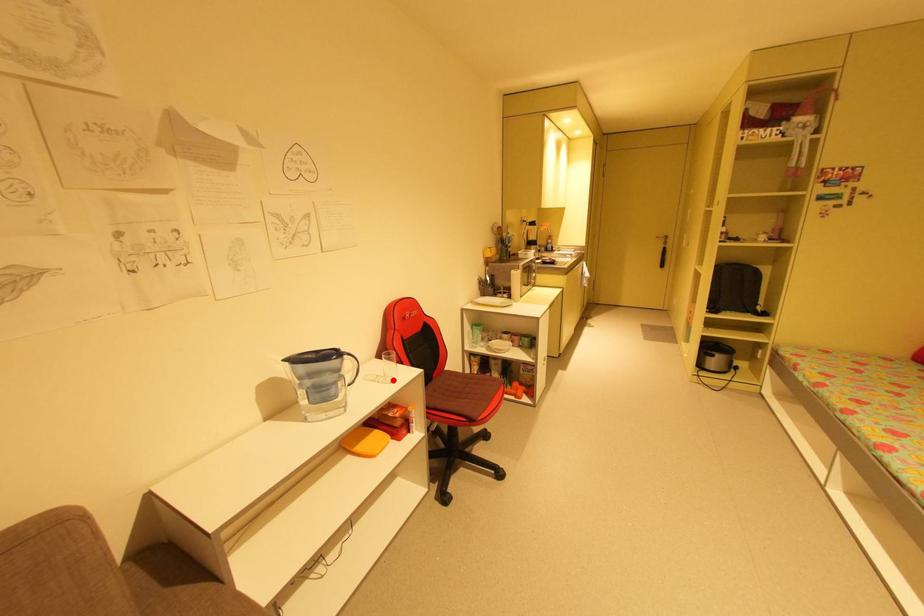
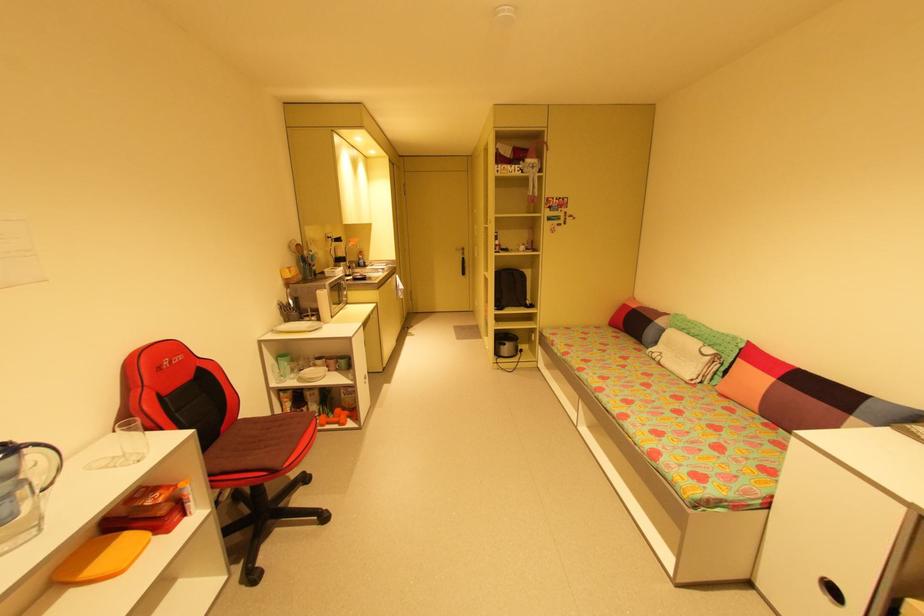
In the second image, find the point that corresponds to the highlighted location in the first image.

(139, 459)